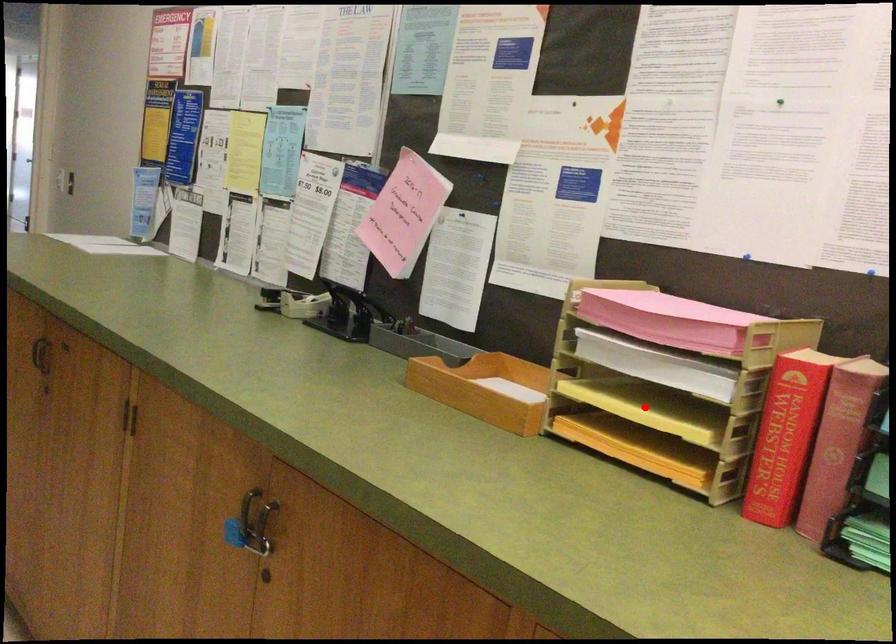
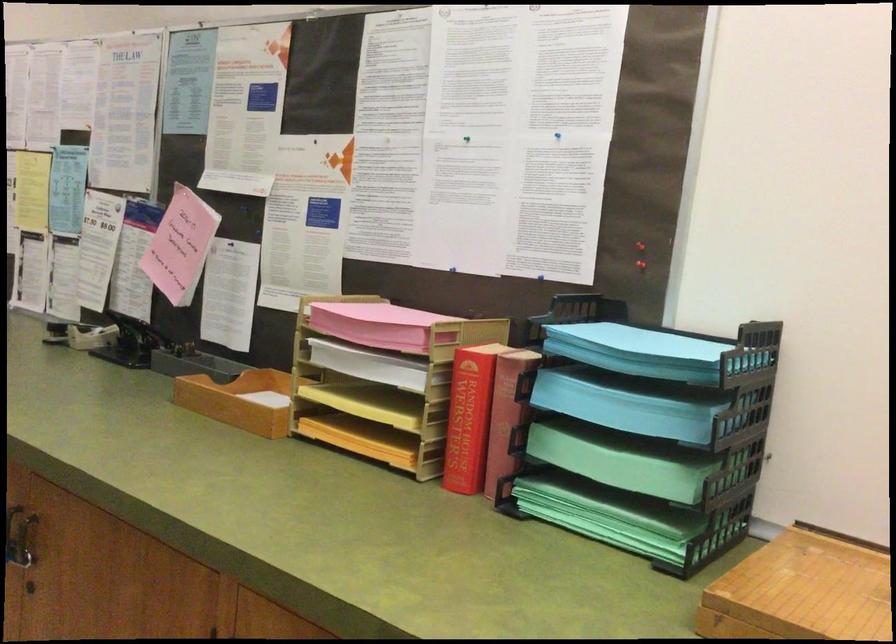
Where in the second image is the point corresponding to the highlighted location from the first image?

(367, 404)